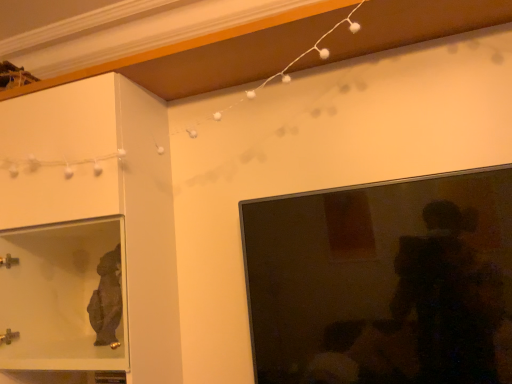
Question: Is matte glass cabinet at left to the right of matte black tv at right from the viewer's perspective?

Choices:
 (A) no
 (B) yes

Answer: (A)

Question: Is matte glass cabinet at left completely or partially outside of matte black tv at right?

Choices:
 (A) no
 (B) yes

Answer: (B)

Question: Does matte glass cabinet at left come behind matte black tv at right?

Choices:
 (A) no
 (B) yes

Answer: (B)

Question: Is matte glass cabinet at left aimed at matte black tv at right?

Choices:
 (A) no
 (B) yes

Answer: (A)

Question: Is matte glass cabinet at left placed right next to matte black tv at right?

Choices:
 (A) yes
 (B) no

Answer: (B)

Question: Considering the relative positions of matte glass cabinet at left and matte black tv at right in the image provided, is matte glass cabinet at left in front of matte black tv at right?

Choices:
 (A) no
 (B) yes

Answer: (A)

Question: Is matte black tv at right taller than matte glass cabinet at left?

Choices:
 (A) yes
 (B) no

Answer: (B)

Question: From a real-world perspective, is matte black tv at right on matte glass cabinet at left?

Choices:
 (A) yes
 (B) no

Answer: (B)

Question: Is matte black tv at right not inside matte glass cabinet at left?

Choices:
 (A) no
 (B) yes

Answer: (B)

Question: Does matte black tv at right have a larger size compared to matte glass cabinet at left?

Choices:
 (A) yes
 (B) no

Answer: (B)

Question: Does matte black tv at right lie in front of matte glass cabinet at left?

Choices:
 (A) no
 (B) yes

Answer: (B)

Question: Is matte black tv at right shorter than matte glass cabinet at left?

Choices:
 (A) yes
 (B) no

Answer: (A)

Question: Is matte black tv at right taller or shorter than matte glass cabinet at left?

Choices:
 (A) tall
 (B) short

Answer: (B)